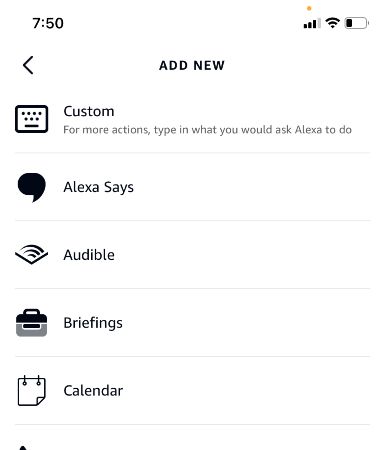
Identify the location of wifi. The height and width of the screenshot is (450, 385). (32, 254).